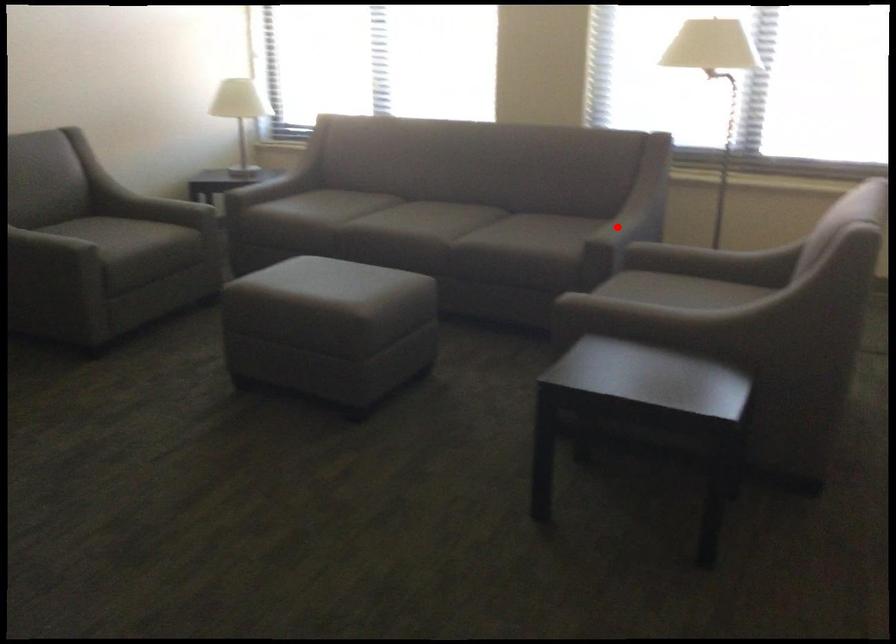
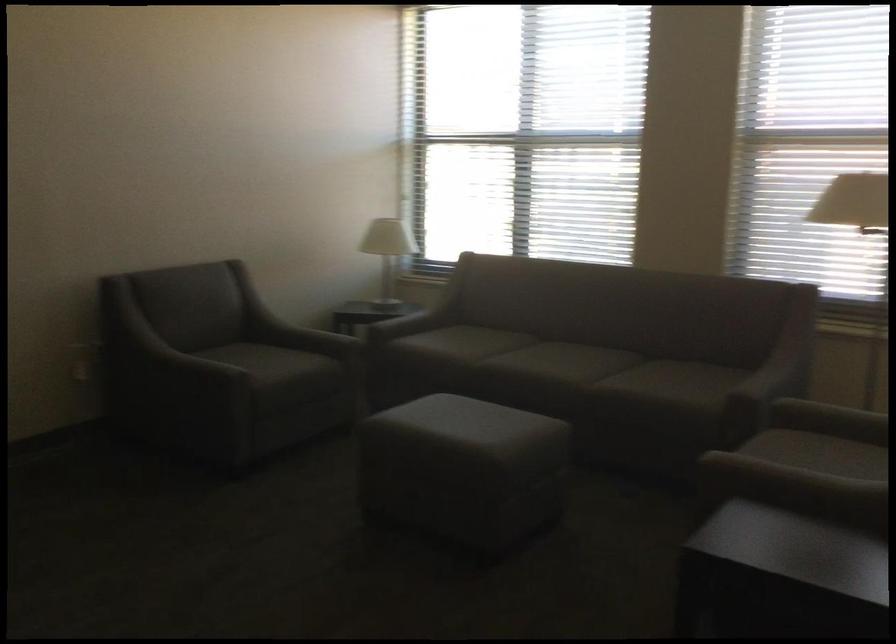
Locate, in the second image, the point that corresponds to the highlighted location in the first image.

(762, 381)